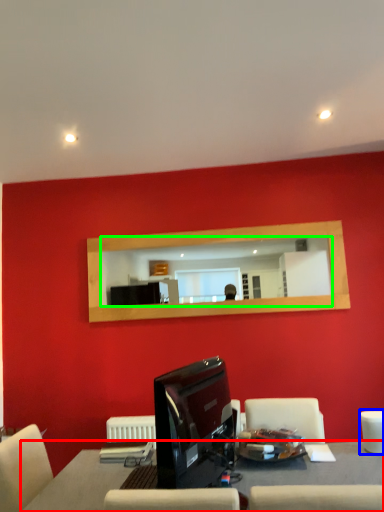
Question: Estimate the real-world distances between objects in this image. Which object is farther from table (highlighted by a red box), armchair (highlighted by a blue box) or mirror (highlighted by a green box)?

Choices:
 (A) armchair
 (B) mirror

Answer: (B)